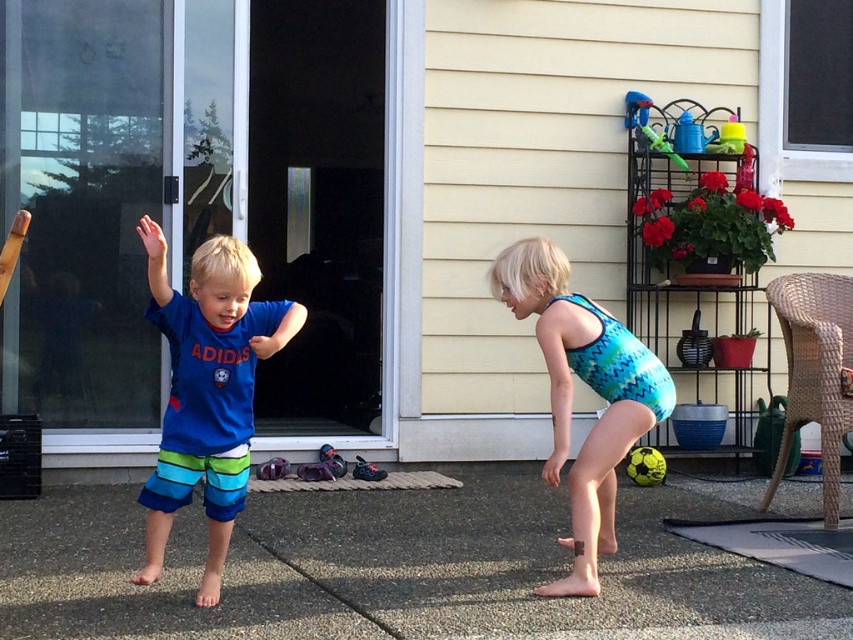
Question: Does transparent glass screen door at center have a smaller size compared to yellow rubber ball at center?

Choices:
 (A) yes
 (B) no

Answer: (B)

Question: Does transparent glass door at left appear under transparent glass screen door at center?

Choices:
 (A) yes
 (B) no

Answer: (B)

Question: Which of these objects is positioned farthest from the transparent glass screen door at center?

Choices:
 (A) blue cotton shirt at left
 (B) green plastic watering can at upper right
 (C) transparent glass door at left
 (D) yellow rubber ball at center

Answer: (A)

Question: Which object is the farthest from the yellow rubber ball at center?

Choices:
 (A) transparent glass screen door at center
 (B) green plastic watering can at upper right

Answer: (A)

Question: Can you confirm if teal zigzag swimsuit at center is thinner than yellow rubber ball at center?

Choices:
 (A) no
 (B) yes

Answer: (A)

Question: Which object is positioned farthest from the green plastic watering can at upper right?

Choices:
 (A) transparent glass door at left
 (B) blue cotton shirt at left

Answer: (A)